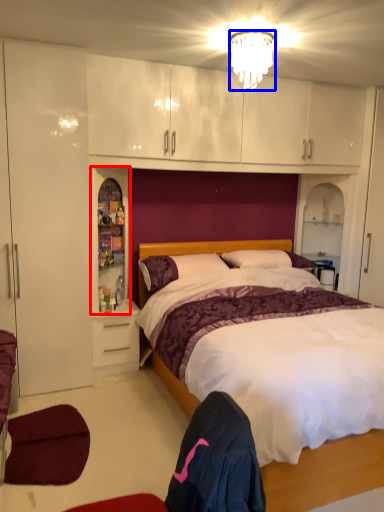
Question: Which of the following is the farthest to the observer, cabinet (highlighted by a red box) or lamp (highlighted by a blue box)?

Choices:
 (A) cabinet
 (B) lamp

Answer: (A)